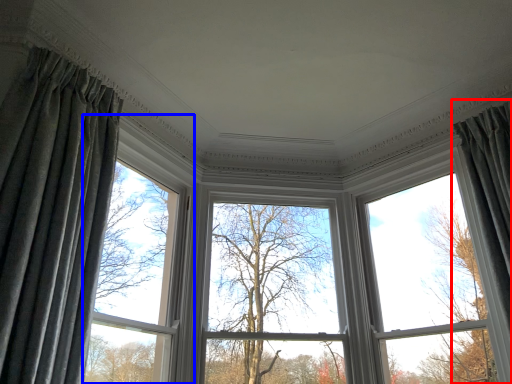
Question: Which of the following is the closest to the observer, curtain (highlighted by a red box) or window (highlighted by a blue box)?

Choices:
 (A) curtain
 (B) window

Answer: (A)